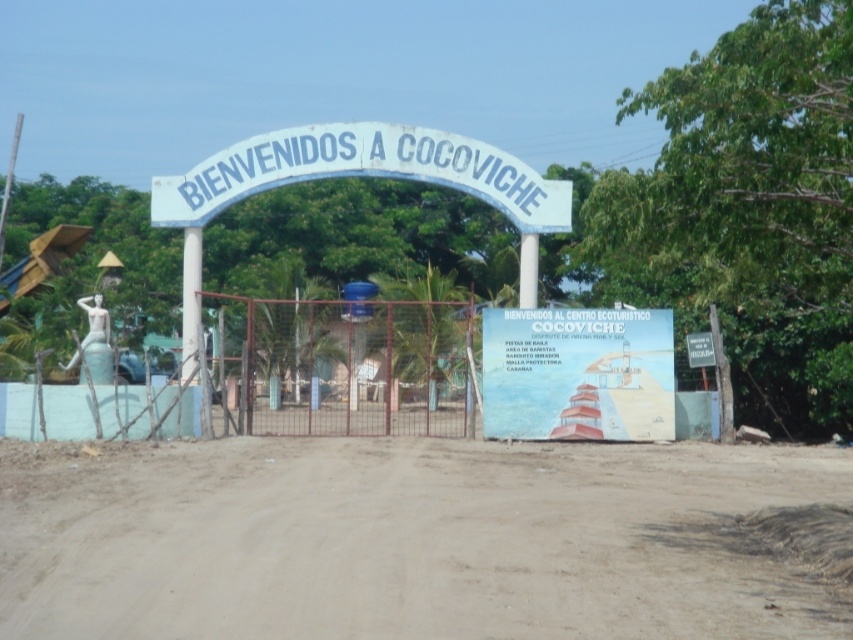
Does brown sandy dirt track at center appear on the right side of white painted wood sign at center?

Correct, you'll find brown sandy dirt track at center to the right of white painted wood sign at center.

Where is `brown sandy dirt track at center`? This screenshot has width=853, height=640. brown sandy dirt track at center is located at coordinates (407, 540).

Is point (515, 448) behind point (395, 125)?

No, it is in front of (395, 125).

At what (x,y) coordinates should I click in order to perform the action: click on brown sandy dirt track at center. Please return your answer as a coordinate pair (x, y). The image size is (853, 640). Looking at the image, I should click on (407, 540).

Which is behind, point (105, 620) or point (654, 413)?

The point (654, 413) is more distant.

Can you confirm if brown sandy dirt track at center is bigger than white painted signboard at center?

Yes, brown sandy dirt track at center is bigger than white painted signboard at center.

Who is more forward, (212, 476) or (572, 432)?

Positioned in front is point (212, 476).

Find the location of a particular element. brown sandy dirt track at center is located at coordinates (407, 540).

Can you confirm if white painted signboard at center is thinner than white painted wood sign at center?

Indeed, white painted signboard at center has a lesser width compared to white painted wood sign at center.

Is point (596, 428) positioned in front of point (434, 172)?

That is True.

Which is behind, point (665, 433) or point (187, 188)?

The point (187, 188) is behind.

At what (x,y) coordinates should I click in order to perform the action: click on white painted signboard at center. Please return your answer as a coordinate pair (x, y). Looking at the image, I should click on (577, 372).